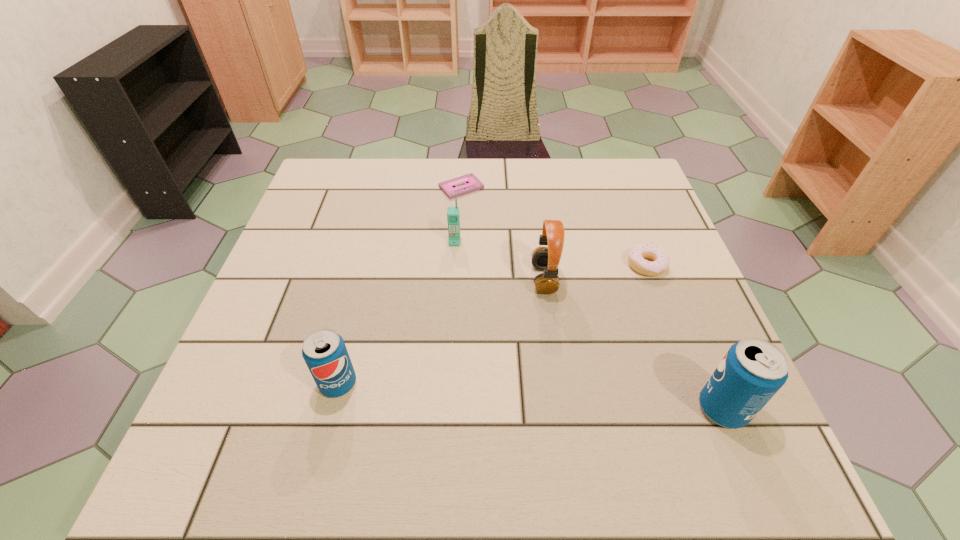
Identify the location of the left soda can. (324, 351).

You are a GUI agent. You are given a task and a screenshot of the screen. Output one action in this format:
    pyautogui.click(x=<x>, y=<y>)
    Task: Click on the leftmost object
    The image size is (960, 540).
    Given the screenshot: What is the action you would take?
    pyautogui.click(x=324, y=351)

Where is `the right soda can`? The width and height of the screenshot is (960, 540). the right soda can is located at coordinates (753, 370).

Identify the location of the shortest object. (472, 183).

Find the location of `the farthest object`. the farthest object is located at coordinates (472, 183).

Locate an element on the screen. cellular telephone is located at coordinates (453, 218).

Find the location of a particular element. the fifth tallest object is located at coordinates (636, 256).

At what (x,y) coordinates should I click in order to perform the action: click on the fourth object from left to right. Please return your answer as a coordinate pair (x, y). Looking at the image, I should click on (546, 259).

The image size is (960, 540). What are the coordinates of `free space located on the right of the shorter soda can` in the screenshot? It's located at (531, 383).

The height and width of the screenshot is (540, 960). I want to click on vacant space situated on the left of the taller soda can, so coord(562,408).